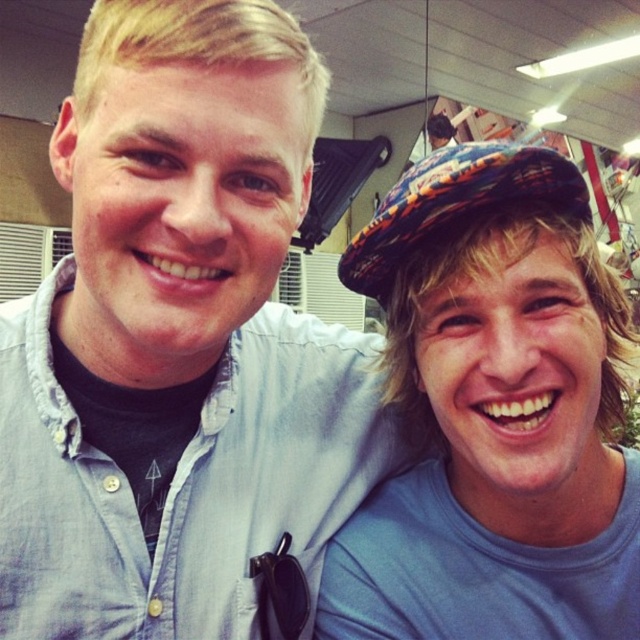
You are a photographer trying to adjust the framing of the image to ensure both the blue fabric shirt at right and the plaid fabric hat at upper right are clearly visible. Given their sizes, which object should you focus on to maintain balance in the composition?

The blue fabric shirt at right is much taller than the plaid fabric hat at upper right, so focusing on the blue fabric shirt at right would help maintain balance by accounting for its larger size in the composition.

You are taking a photo of two people standing in a store. You notice two points in the image at coordinates point (97, 410) and point (374, 604). Which point is nearer to the camera?

Point (97, 410) is closer to the camera than point (374, 604).